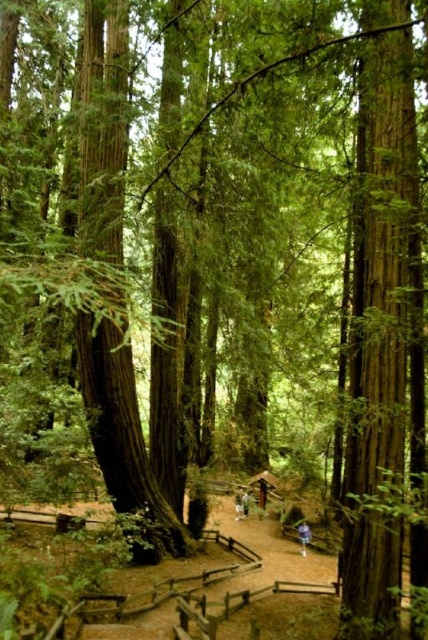
You are standing on the dirt path in the forest and see two points marked on the ground. The first point is labeled as point (235,497) and the second as point (247,506). If you are facing the direction of the path, which point is closer to you?

Point (247,506) is closer to you because it is in front of point (235,497).